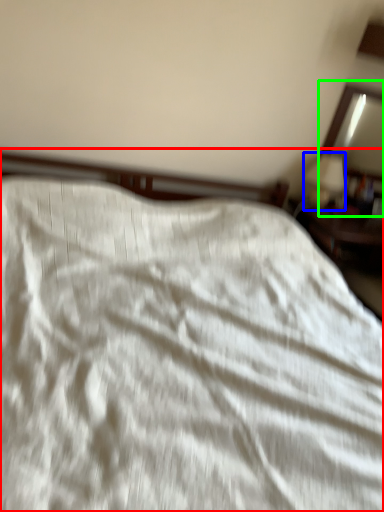
Question: Which is farther away from bed (highlighted by a red box)? table lamp (highlighted by a blue box) or mirror (highlighted by a green box)?

Choices:
 (A) table lamp
 (B) mirror

Answer: (B)